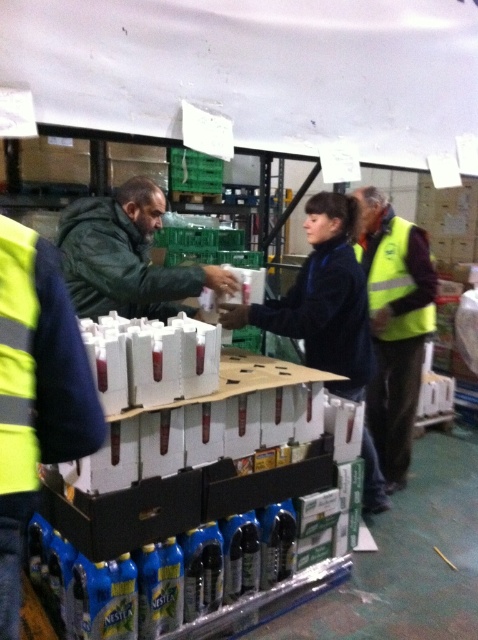
Does yellow reflective vest at right appear under yellow reflective safety vest at right?

Yes, yellow reflective vest at right is below yellow reflective safety vest at right.

Is the position of yellow reflective vest at right more distant than that of yellow reflective safety vest at right?

No.

What are the coordinates of `yellow reflective vest at right` in the screenshot? It's located at (394, 324).

Between yellow reflective vest at right and green matte jacket at center, which one is positioned lower?

yellow reflective vest at right is below.

Who is more forward, (391, 243) or (83, 264)?

Positioned in front is point (83, 264).

Where is `yellow reflective vest at right`? The height and width of the screenshot is (640, 478). yellow reflective vest at right is located at coordinates (394, 324).

Is point (235, 285) closer to camera compared to point (412, 300)?

Yes, point (235, 285) is in front of point (412, 300).

Does green matte jacket at center have a lesser height compared to yellow reflective safety vest at right?

Indeed, green matte jacket at center has a lesser height compared to yellow reflective safety vest at right.

Which is behind, point (88, 275) or point (392, 250)?

Point (392, 250)

You are a GUI agent. You are given a task and a screenshot of the screen. Output one action in this format:
    pyautogui.click(x=<x>, y=<y>)
    Task: Click on the green matte jacket at center
    The width and height of the screenshot is (478, 640).
    Given the screenshot: What is the action you would take?
    pyautogui.click(x=127, y=257)